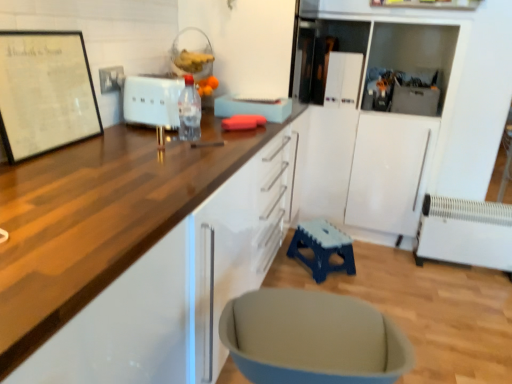
Locate an element on the screen. This screenshot has width=512, height=384. vacant space to the right of blue plastic stool at lower center is located at coordinates (374, 275).